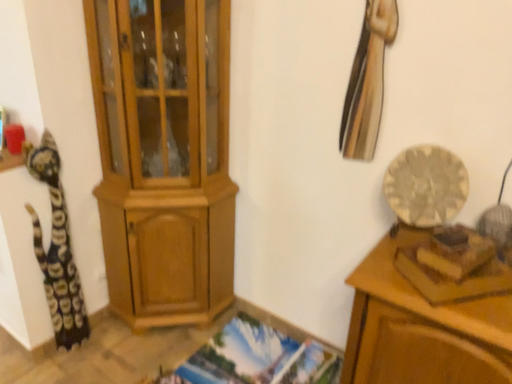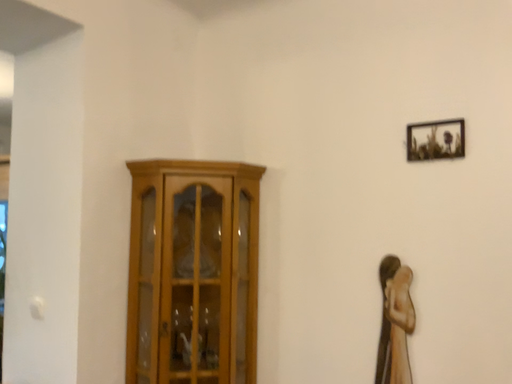
Question: How did the camera likely rotate when shooting the video?

Choices:
 (A) rotated downward
 (B) rotated upward

Answer: (B)